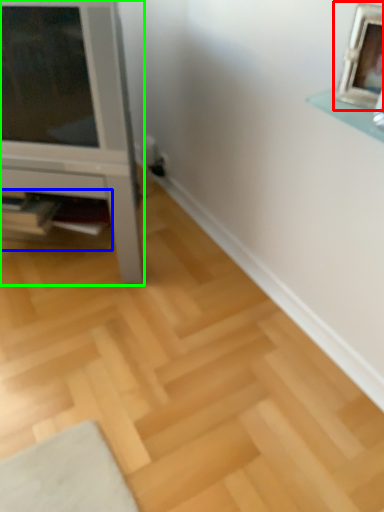
Question: Estimate the real-world distances between objects in this image. Which object is closer to picture frame (highlighted by a red box), shelf (highlighted by a blue box) or furniture (highlighted by a green box)?

Choices:
 (A) shelf
 (B) furniture

Answer: (B)